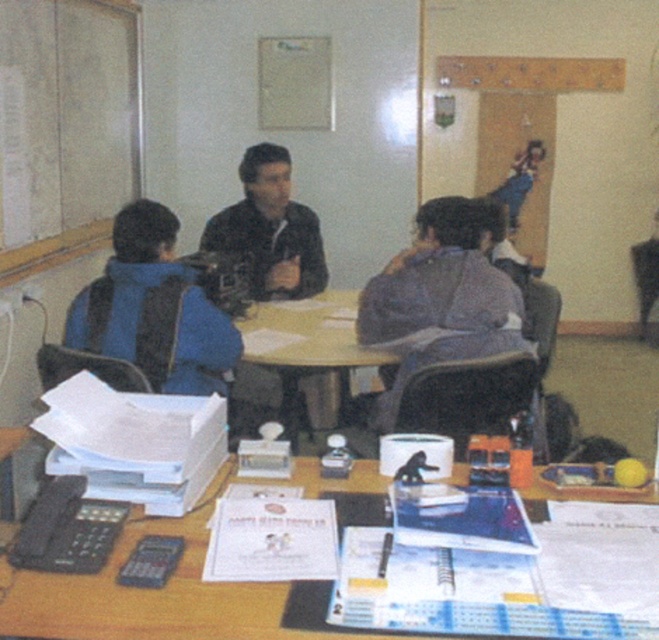
From the picture: Is wooden desk at lower center taller than black matte jacket at center?

Incorrect, wooden desk at lower center's height is not larger of black matte jacket at center's.

Identify the location of wooden desk at lower center. (148, 593).

Is point (196, 532) closer to camera compared to point (326, 284)?

Yes.

At what (x,y) coordinates should I click in order to perform the action: click on wooden desk at lower center. Please return your answer as a coordinate pair (x, y). This screenshot has width=659, height=640. Looking at the image, I should click on (148, 593).

Does wooden table at center appear on the right side of black matte jacket at center?

Indeed, wooden table at center is positioned on the right side of black matte jacket at center.

Where is `wooden table at center`? wooden table at center is located at coordinates (302, 353).

How far apart are wooden desk at lower center and blue denim jeans at upper center?

wooden desk at lower center and blue denim jeans at upper center are 4.55 meters apart from each other.

Is point (9, 616) closer to viewer compared to point (515, 168)?

Yes.

Which is behind, point (111, 588) or point (527, 188)?

The point (527, 188) is behind.

The width and height of the screenshot is (659, 640). I want to click on wooden desk at lower center, so click(148, 593).